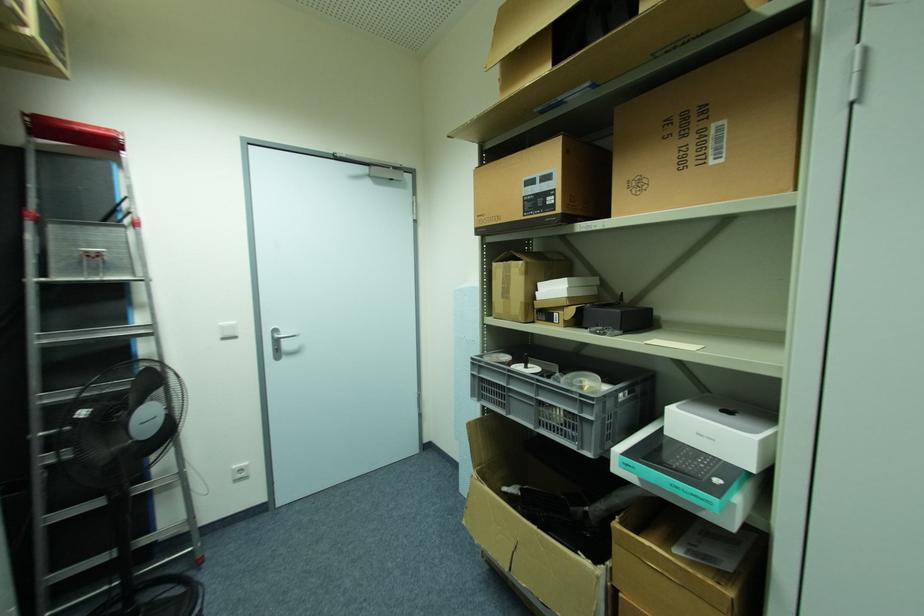
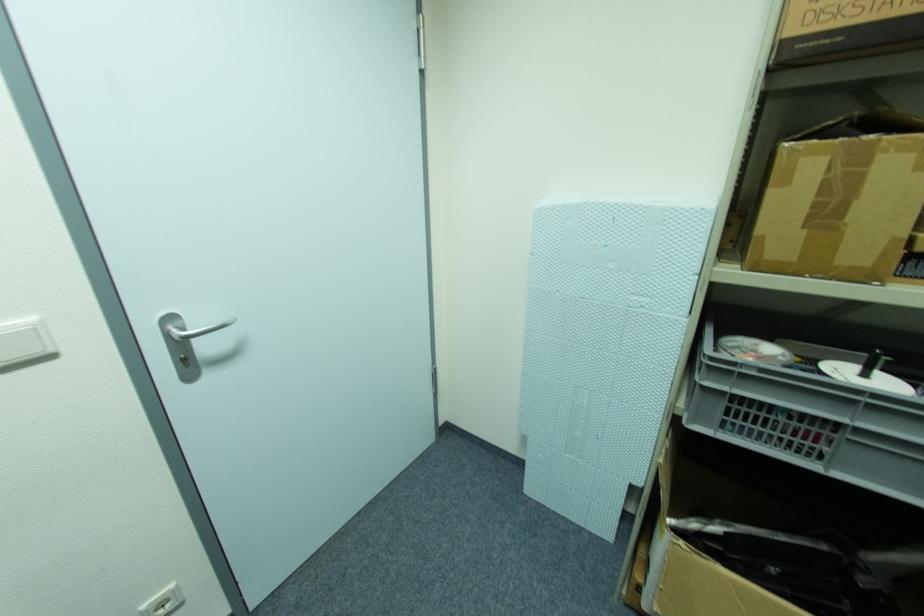
Locate, in the second image, the point that corresponds to the point at 527,368 in the first image.

(867, 376)